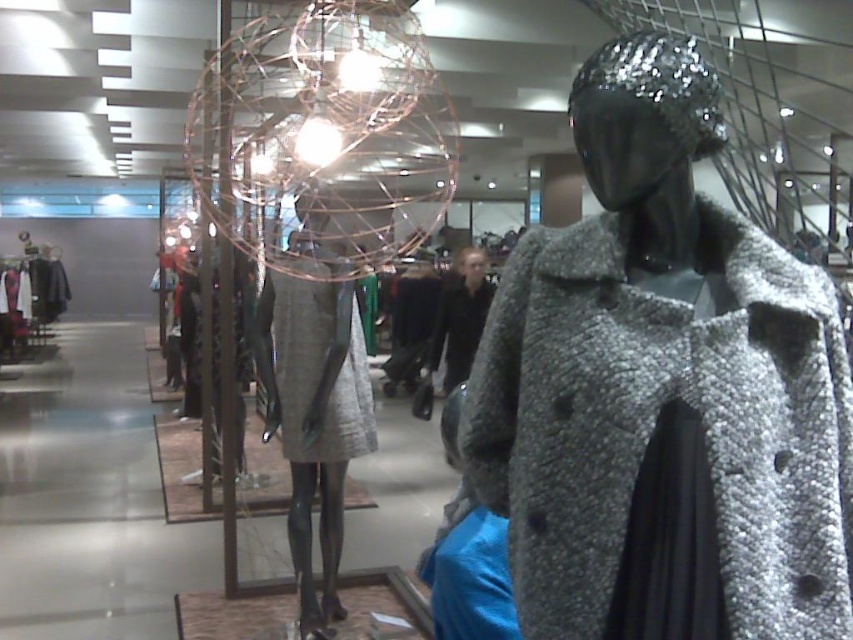
Which of these two, sparkly silver coat at center or matte gray skirt at center, stands taller?

With more height is matte gray skirt at center.

The height and width of the screenshot is (640, 853). I want to click on sparkly silver coat at center, so click(663, 392).

The width and height of the screenshot is (853, 640). What do you see at coordinates (314, 397) in the screenshot?
I see `matte gray skirt at center` at bounding box center [314, 397].

Does point (346, 324) come farther from viewer compared to point (300, 298)?

No, (346, 324) is closer to viewer.

Identify the location of matte gray skirt at center. This screenshot has width=853, height=640. (314, 397).

Is sparkly silver coat at center shorter than gray woolen coat at center?

Yes, sparkly silver coat at center is shorter than gray woolen coat at center.

Between sparkly silver coat at center and gray woolen coat at center, which one appears on the right side from the viewer's perspective?

sparkly silver coat at center is more to the right.

Where is `sparkly silver coat at center`? sparkly silver coat at center is located at coordinates (663, 392).